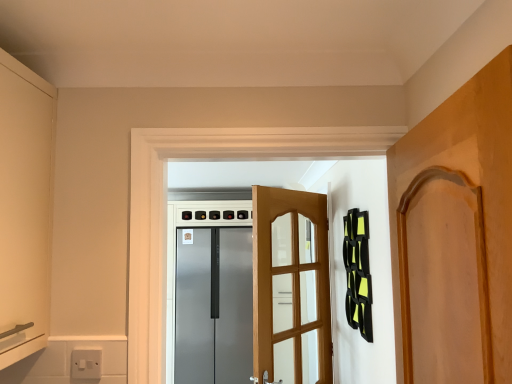
Question: Is white plastic switch at lower left thinner than wooden door at center, positioned as the first door in back-to-front order?

Choices:
 (A) no
 (B) yes

Answer: (B)

Question: Could you tell me if white plastic switch at lower left is turned towards wooden door at center, positioned as the first door in back-to-front order?

Choices:
 (A) yes
 (B) no

Answer: (B)

Question: Is white plastic switch at lower left taller than wooden door at center, the second door positioned from the front?

Choices:
 (A) yes
 (B) no

Answer: (B)

Question: From a real-world perspective, is white plastic switch at lower left physically below wooden door at center, the second door positioned from the front?

Choices:
 (A) yes
 (B) no

Answer: (A)

Question: Does white plastic switch at lower left have a greater width compared to wooden door at center, the second door positioned from the front?

Choices:
 (A) no
 (B) yes

Answer: (A)

Question: Is white plastic switch at lower left to the left of wooden door at center, the second door positioned from the front, from the viewer's perspective?

Choices:
 (A) no
 (B) yes

Answer: (B)

Question: Does white plastic switch at lower left have a lesser height compared to satin silver refrigerator at center?

Choices:
 (A) yes
 (B) no

Answer: (A)

Question: Is satin silver refrigerator at center surrounded by white plastic switch at lower left?

Choices:
 (A) yes
 (B) no

Answer: (B)

Question: Is white plastic switch at lower left further to camera compared to satin silver refrigerator at center?

Choices:
 (A) yes
 (B) no

Answer: (B)

Question: Is white plastic switch at lower left facing towards satin silver refrigerator at center?

Choices:
 (A) no
 (B) yes

Answer: (A)

Question: Is white plastic switch at lower left completely or partially outside of satin silver refrigerator at center?

Choices:
 (A) no
 (B) yes

Answer: (B)

Question: Is satin silver refrigerator at center at the back of white plastic switch at lower left?

Choices:
 (A) yes
 (B) no

Answer: (A)

Question: Is wooden door at center, positioned as the first door in back-to-front order, outside wooden door at right, the 2th door positioned from the back?

Choices:
 (A) no
 (B) yes

Answer: (B)